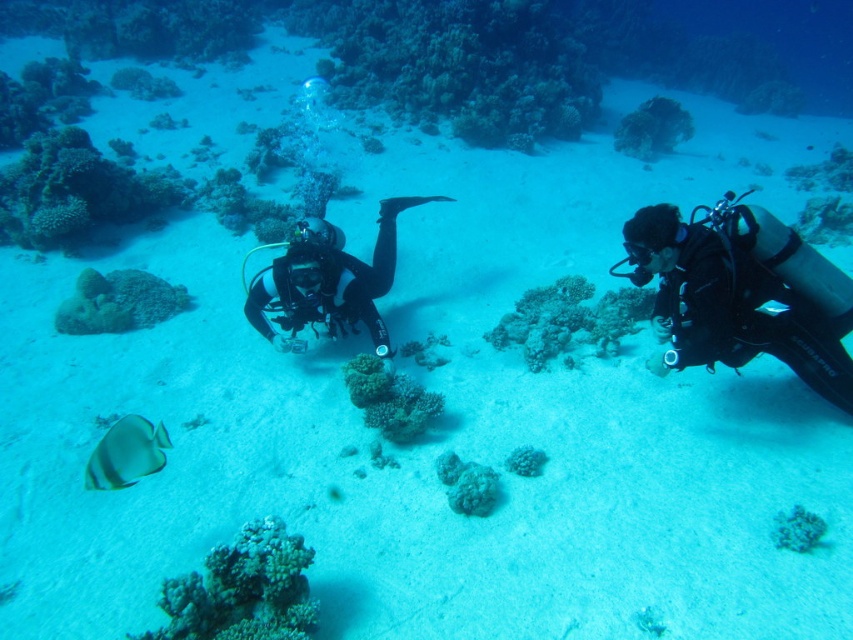
This screenshot has height=640, width=853. Identify the location of translucent yellowish-green fish at lower left. (126, 452).

Can you confirm if translucent yellowish-green fish at lower left is positioned to the right of smooth white coral at center?

Incorrect, translucent yellowish-green fish at lower left is not on the right side of smooth white coral at center.

Describe the element at coordinates (126, 452) in the screenshot. The image size is (853, 640). I see `translucent yellowish-green fish at lower left` at that location.

This screenshot has width=853, height=640. Find the location of `translucent yellowish-green fish at lower left`. translucent yellowish-green fish at lower left is located at coordinates (126, 452).

Is black matte scuba diver at right wider than black matte scuba diver at center?

No, black matte scuba diver at right is not wider than black matte scuba diver at center.

Is black matte scuba diver at right shorter than black matte scuba diver at center?

Yes, black matte scuba diver at right is shorter than black matte scuba diver at center.

Who is more forward, (637, 234) or (285, 348)?

Positioned in front is point (637, 234).

Identify the location of black matte scuba diver at right. The width and height of the screenshot is (853, 640). (743, 292).

Which is more to the left, black matte scuba diver at center or smooth coral at center?

Positioned to the left is black matte scuba diver at center.

Can you confirm if black matte scuba diver at center is positioned below smooth coral at center?

Actually, black matte scuba diver at center is above smooth coral at center.

Does point (300, 278) come in front of point (575, 330)?

Yes, it is in front of point (575, 330).

Where is `black matte scuba diver at center`? black matte scuba diver at center is located at coordinates (328, 282).